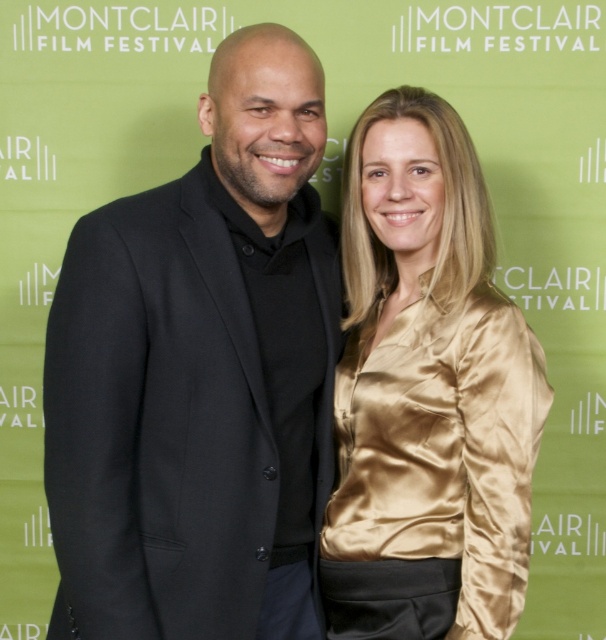
Does black wool suit at center have a greater height compared to gold satin blouse at center?

Yes, black wool suit at center is taller than gold satin blouse at center.

Does black wool suit at center have a greater width compared to gold satin blouse at center?

Indeed, black wool suit at center has a greater width compared to gold satin blouse at center.

You are a GUI agent. You are given a task and a screenshot of the screen. Output one action in this format:
    pyautogui.click(x=<x>, y=<y>)
    Task: Click on the black wool suit at center
    
    Given the screenshot: What is the action you would take?
    pyautogui.click(x=201, y=374)